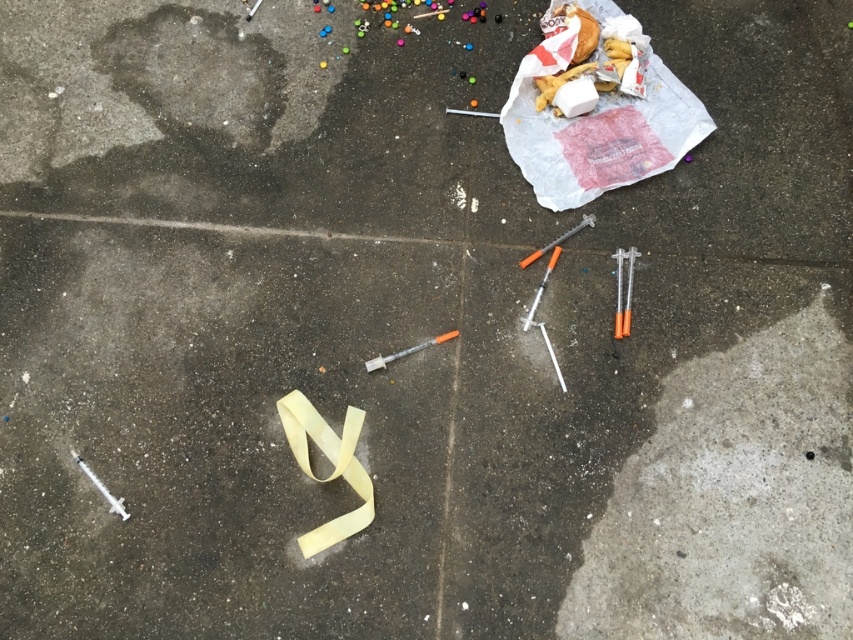
Question: Can you confirm if clear plastic needle at center is positioned to the right of clear plastic needle at upper center?

Choices:
 (A) no
 (B) yes

Answer: (B)

Question: Does smooth concrete at bottom right appear under white plastic syringe at lower left?

Choices:
 (A) yes
 (B) no

Answer: (A)

Question: Which point is closer to the camera taking this photo?

Choices:
 (A) (553, 253)
 (B) (564, 236)
 (C) (107, 493)

Answer: (C)

Question: Does matte gray needle at center appear under metallic silver needle at center?

Choices:
 (A) no
 (B) yes

Answer: (A)

Question: Which object appears farthest from the camera in this image?

Choices:
 (A) matte gray needle at center
 (B) translucent plastic syringe at center

Answer: (A)

Question: Which of these objects is positioned farthest from the matte gray needle at center?

Choices:
 (A) clear plastic needle at center
 (B) translucent plastic syringe at center right

Answer: (B)